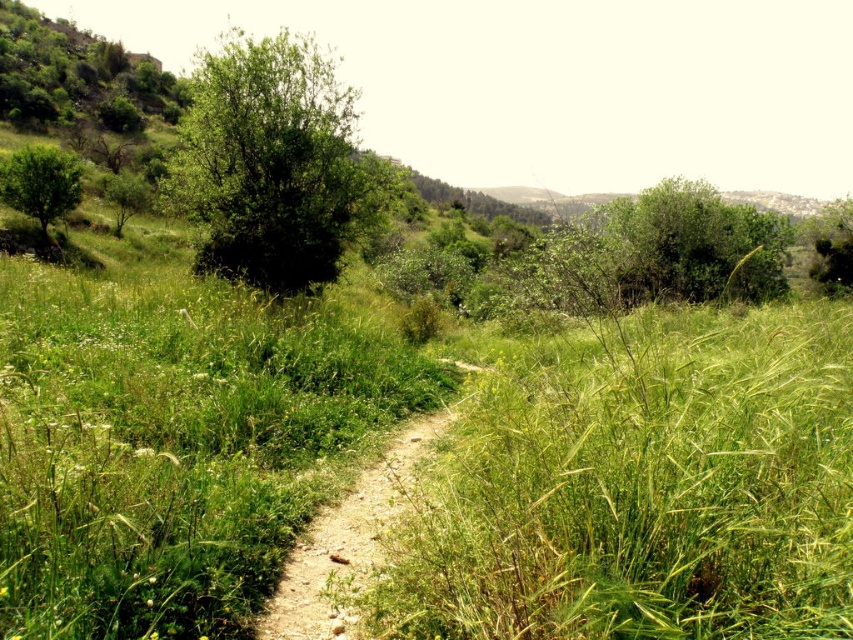
Is green leafy bush at upper right wider than green leafy tree at left?

In fact, green leafy bush at upper right might be narrower than green leafy tree at left.

Does green leafy bush at upper right have a lesser height compared to green leafy tree at left?

Yes, green leafy bush at upper right is shorter than green leafy tree at left.

Identify the location of green leafy bush at upper right. The width and height of the screenshot is (853, 640). (691, 244).

Can you confirm if green leafy bush at upper right is shorter than green leafy tree at upper right?

Yes, green leafy bush at upper right is shorter than green leafy tree at upper right.

Who is more forward, [756,275] or [836,209]?

Point [756,275] is in front.

Does point (660, 260) come closer to viewer compared to point (822, 244)?

That is True.

Find the location of a particular element. green leafy bush at upper right is located at coordinates (691, 244).

The height and width of the screenshot is (640, 853). What do you see at coordinates (273, 163) in the screenshot?
I see `green leafy bush at center` at bounding box center [273, 163].

Measure the distance between green leafy bush at center and camera.

14.38 meters

Where is `green leafy bush at center`? Image resolution: width=853 pixels, height=640 pixels. green leafy bush at center is located at coordinates (273, 163).